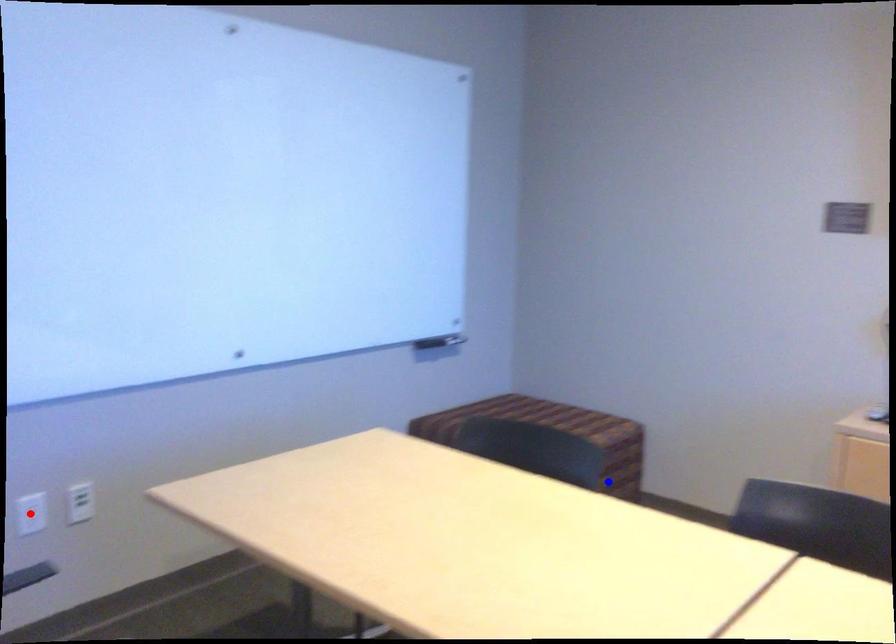
Question: Which of the two points in the image is closer to the camera?

Choices:
 (A) Blue point is closer.
 (B) Red point is closer.

Answer: (B)